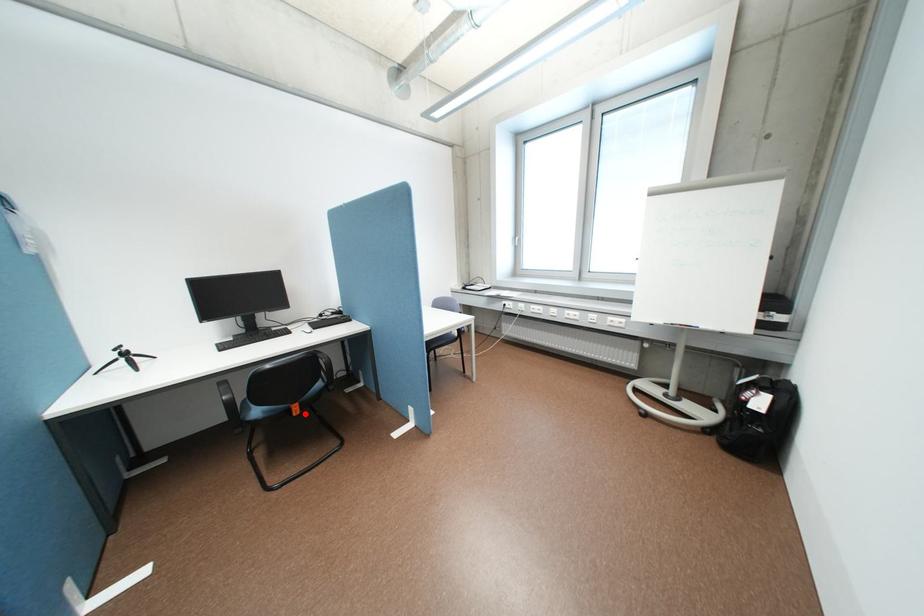
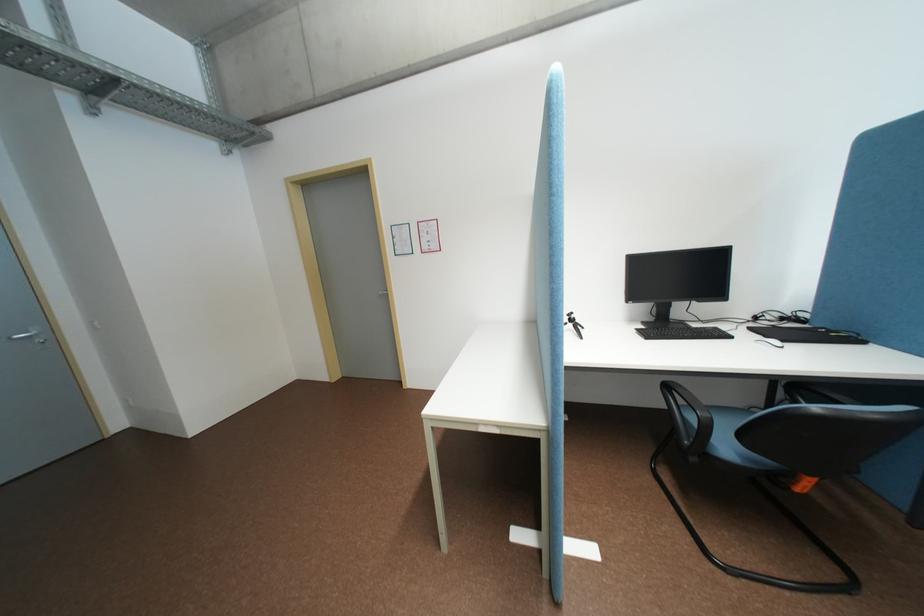
Question: I am providing you with two images of the same scene from different viewpoints. Given a red point in image1, look at the same physical point in image2. Is it:

Choices:
 (A) Closer to the viewpoint
 (B) Farther from the viewpoint

Answer: (A)